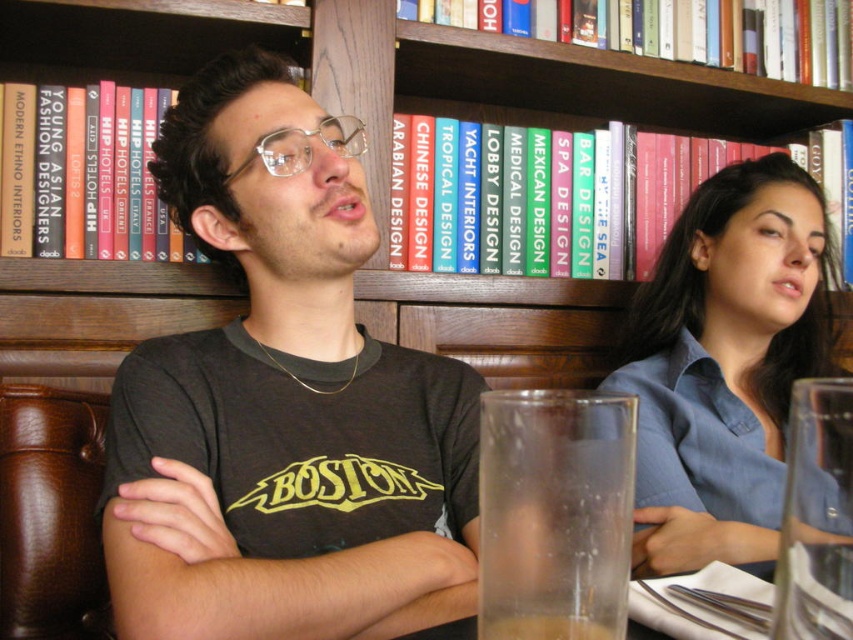
Does point (227, 129) lie behind point (637, 298)?

No, (227, 129) is in front of (637, 298).

Who is more distant from viewer, (125, 426) or (688, 506)?

Positioned behind is point (688, 506).

In order to click on dark gray t-shirt at center in this screenshot , I will do `click(283, 410)`.

Between point (717, 237) and point (482, 397), which one is positioned in front?

Point (482, 397) is more forward.

Does blue cotton shirt at upper right have a smaller size compared to translucent glass at center?

Incorrect, blue cotton shirt at upper right is not smaller in size than translucent glass at center.

Identify the location of blue cotton shirt at upper right. (724, 364).

The image size is (853, 640). Find the location of `blue cotton shirt at upper right`. blue cotton shirt at upper right is located at coordinates (724, 364).

Can you confirm if translucent glass at center is positioned to the right of clear plastic glasses at center?

Correct, you'll find translucent glass at center to the right of clear plastic glasses at center.

Is point (583, 560) positioned after point (283, 140)?

No, (583, 560) is in front of (283, 140).

Where is `translucent glass at center`? translucent glass at center is located at coordinates coord(554,513).